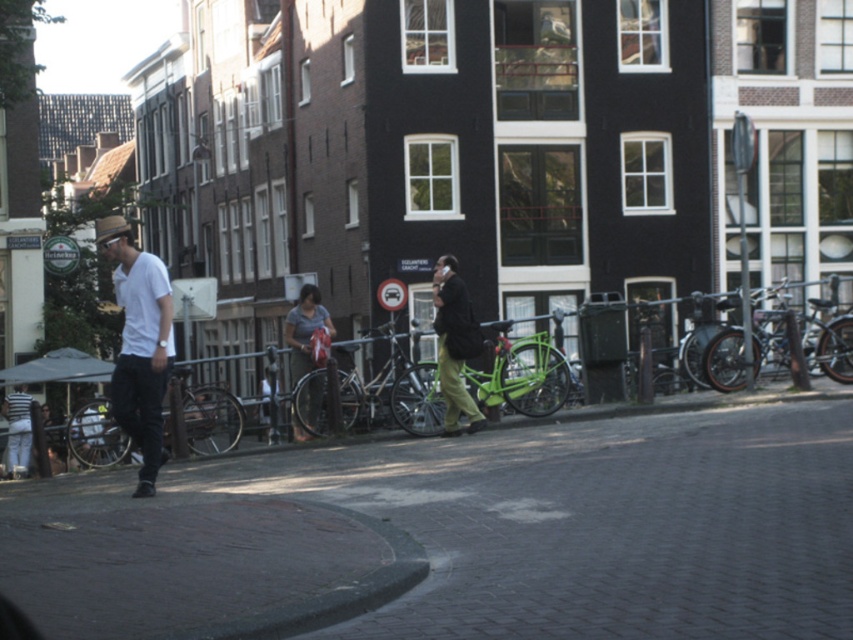
Locate an element on the screen. This screenshot has height=640, width=853. green matte bicycle at center is located at coordinates (520, 372).

This screenshot has width=853, height=640. What do you see at coordinates (520, 372) in the screenshot?
I see `green matte bicycle at center` at bounding box center [520, 372].

What do you see at coordinates (520, 372) in the screenshot? The height and width of the screenshot is (640, 853). I see `green matte bicycle at center` at bounding box center [520, 372].

The height and width of the screenshot is (640, 853). I want to click on green matte bicycle at center, so click(520, 372).

Consider the image. Between brick pavement at center and white matte shirt at left, which one has more height?

With more height is white matte shirt at left.

Is point (395, 518) farther from viewer compared to point (148, 266)?

No, it is not.

Locate an element on the screen. This screenshot has width=853, height=640. brick pavement at center is located at coordinates (578, 522).

Does green matte bicycle at center appear over matte gray shirt at center?

No.

Is green matte bicycle at center taller than matte gray shirt at center?

No.

What do you see at coordinates (520, 372) in the screenshot? I see `green matte bicycle at center` at bounding box center [520, 372].

Locate an element on the screen. This screenshot has height=640, width=853. green matte bicycle at center is located at coordinates (520, 372).